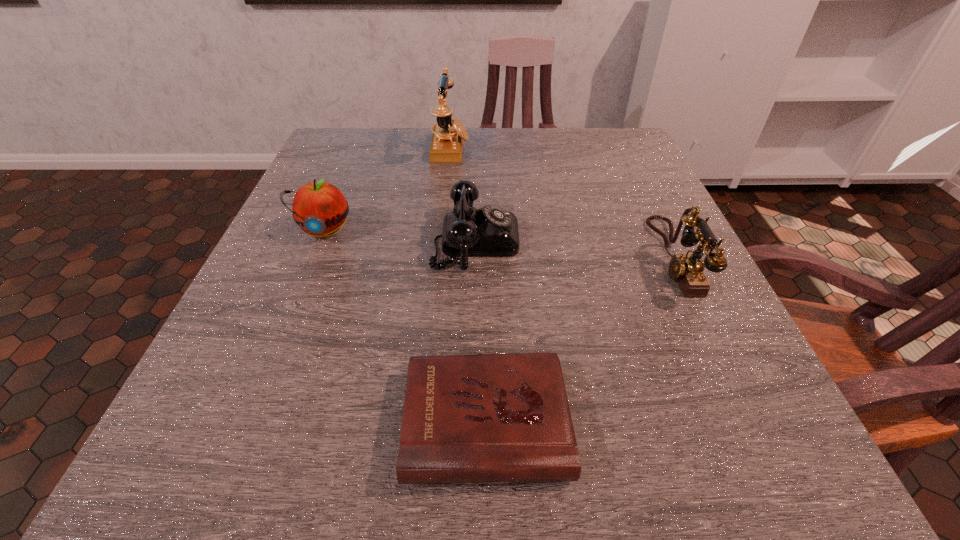
Identify the location of vacant position in the image that satisfies the following two spatial constraints: 1. on the back side of the nearest object; 2. on the dial of the farthest telephone. This screenshot has height=540, width=960. (483, 148).

Locate an element on the screen. The width and height of the screenshot is (960, 540). free space that satisfies the following two spatial constraints: 1. on the dial of the hardback book; 2. on the right side of the tallest object is located at coordinates (422, 422).